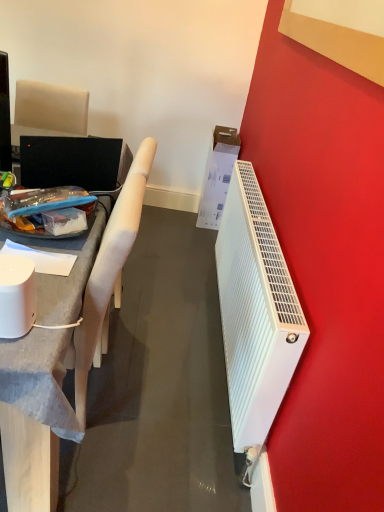
Measure the distance between point (106, 294) and camera.

Point (106, 294) is 4.27 feet away from camera.

Locate an element on the screen. white fabric chair at left is located at coordinates (108, 275).

I want to click on matte gray desk at left, so click(x=29, y=461).

Image resolution: width=384 pixels, height=512 pixels. I want to click on white fabric chair at left, so click(108, 275).

Between white fabric chair at left and white plastic radiator at right, which one has less height?

Standing shorter between the two is white plastic radiator at right.

How much distance is there between white fabric chair at left and white plastic radiator at right?

white fabric chair at left and white plastic radiator at right are 23.59 inches apart.

At what (x,y) coordinates should I click in order to perform the action: click on chair above the white plastic radiator at right (from a real-world perspective). Please return your answer as a coordinate pair (x, y). Looking at the image, I should click on (108, 275).

Considering the positions of objects white fabric chair at left and white plastic radiator at right in the image provided, who is more to the left, white fabric chair at left or white plastic radiator at right?

white fabric chair at left is more to the left.

Which is farther, (211, 147) or (18, 261)?

The point (211, 147) is farther from the camera.

From a real-world perspective, is white cardboard box at right located beneath white glossy smart speaker at left?

Correct, in the physical world, white cardboard box at right is lower than white glossy smart speaker at left.

Is white glossy smart speaker at left a part of white cardboard box at right?

No, white glossy smart speaker at left is not a part of white cardboard box at right.

Would you say white glossy smart speaker at left is a long distance from white fabric chair at left?

Actually, white glossy smart speaker at left and white fabric chair at left are a little close together.

How many degrees apart are the facing directions of white glossy smart speaker at left and white fabric chair at left?

white glossy smart speaker at left and white fabric chair at left are facing 90 degrees away from each other.

Identify the location of appliance that is above the white fabric chair at left (from the image's perspective). tap(16, 296).

From the image's perspective, is white glossy smart speaker at left above white fabric chair at left?

Correct, white glossy smart speaker at left appears higher than white fabric chair at left in the image.

Looking at the image, does white fabric chair at left seem bigger or smaller compared to white glossy smart speaker at left?

Clearly, white fabric chair at left is larger in size than white glossy smart speaker at left.

Does white fabric chair at left appear on the left side of white glossy smart speaker at left?

Correct, you'll find white fabric chair at left to the left of white glossy smart speaker at left.

Between white fabric chair at left and white glossy smart speaker at left, which one has smaller width?

With smaller width is white glossy smart speaker at left.

How distant is white fabric chair at left from white glossy smart speaker at left?

white fabric chair at left is 13.53 inches away from white glossy smart speaker at left.

Considering the relative positions of matte gray desk at left and white cardboard box at right in the image provided, is matte gray desk at left to the right of white cardboard box at right from the viewer's perspective?

Incorrect, matte gray desk at left is not on the right side of white cardboard box at right.

This screenshot has width=384, height=512. I want to click on box that is under the matte gray desk at left (from a real-world perspective), so click(217, 176).

Which object is further away from the camera taking this photo, matte gray desk at left or white cardboard box at right?

white cardboard box at right is further from the camera.

In the scene shown: Would you consider matte gray desk at left to be distant from white cardboard box at right?

Absolutely, matte gray desk at left is distant from white cardboard box at right.

From a real-world perspective, is white cardboard box at right physically above white fabric chair at left?

Incorrect, from a real-world perspective, white cardboard box at right is lower than white fabric chair at left.

Does point (220, 143) come closer to viewer compared to point (96, 272)?

No, (220, 143) is further to viewer.

Based on the photo, considering the sizes of objects white plastic radiator at right and white fabric chair at left in the image provided, who is smaller, white plastic radiator at right or white fabric chair at left?

With smaller size is white plastic radiator at right.

The image size is (384, 512). Find the location of `chair above the white plastic radiator at right (from a real-world perspective)`. chair above the white plastic radiator at right (from a real-world perspective) is located at coordinates (108, 275).

Based on the photo, from a real-world perspective, is white plastic radiator at right positioned over white fabric chair at left based on gravity?

Incorrect, from a real-world perspective, white plastic radiator at right is lower than white fabric chair at left.

Locate an element on the screen. This screenshot has height=512, width=384. radiator that appears above the white fabric chair at left (from the image's perspective) is located at coordinates (255, 311).

I want to click on appliance that is on the left side of white cardboard box at right, so click(x=16, y=296).

From the image, which object appears to be farther from matte gray desk at left, white glossy smart speaker at left or white cardboard box at right?

white cardboard box at right is further to matte gray desk at left.

When comparing their distances from white plastic radiator at right, does matte gray desk at left or white glossy smart speaker at left seem closer?

Based on the image, matte gray desk at left appears to be nearer to white plastic radiator at right.

Based on their spatial positions, is white glossy smart speaker at left or white cardboard box at right closer to white fabric chair at left?

white glossy smart speaker at left.

From the image, which object appears to be nearer to white plastic radiator at right, white fabric chair at left or matte gray desk at left?

The object closer to white plastic radiator at right is white fabric chair at left.

From the image, which object appears to be farther from matte gray desk at left, white fabric chair at left or white cardboard box at right?

white cardboard box at right lies further to matte gray desk at left than the other object.

Which object lies nearer to the anchor point white cardboard box at right, white glossy smart speaker at left or white fabric chair at left?

Based on the image, white fabric chair at left appears to be nearer to white cardboard box at right.

Considering their positions, is white fabric chair at left positioned further to white plastic radiator at right than white glossy smart speaker at left?

white glossy smart speaker at left is further to white plastic radiator at right.

Based on their spatial positions, is white glossy smart speaker at left or white fabric chair at left closer to white plastic radiator at right?

white fabric chair at left.

You are a GUI agent. You are given a task and a screenshot of the screen. Output one action in this format:
    pyautogui.click(x=<x>, y=<y>)
    Task: Click on the radiator between white fabric chair at left and white cardboard box at right along the z-axis
    
    Given the screenshot: What is the action you would take?
    pyautogui.click(x=255, y=311)

In order to click on chair between white glossy smart speaker at left and white cardboard box at right along the z-axis in this screenshot , I will do `click(108, 275)`.

The width and height of the screenshot is (384, 512). In order to click on chair between matte gray desk at left and white cardboard box at right along the z-axis in this screenshot , I will do `click(108, 275)`.

Where is `appliance situated between white fabric chair at left and white plastic radiator at right from left to right`? The image size is (384, 512). appliance situated between white fabric chair at left and white plastic radiator at right from left to right is located at coordinates (16, 296).